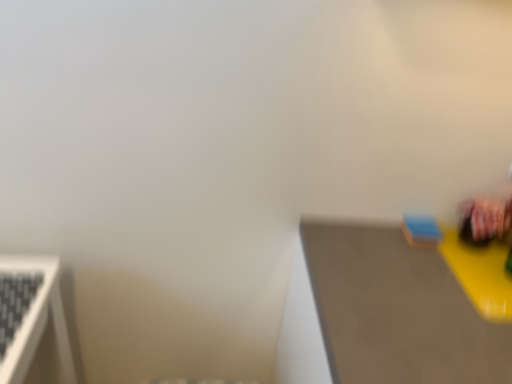
Question: Relative to smooth gray table at right, is matte plastic toy at right, which appears as the 2th toy when viewed from the left, in front or behind?

Choices:
 (A) front
 (B) behind

Answer: (B)

Question: Based on their sizes in the image, would you say matte plastic toy at right, which is counted as the 1th toy, starting from the right, is bigger or smaller than smooth gray table at right?

Choices:
 (A) big
 (B) small

Answer: (B)

Question: Which is farther from the blue matte sponge at upper right, which is the first toy in left-to-right order?

Choices:
 (A) matte plastic toy at right, which appears as the 2th toy when viewed from the left
 (B) smooth gray table at right

Answer: (B)

Question: Which object is positioned closest to the blue matte sponge at upper right, placed as the 2th toy when sorted from right to left?

Choices:
 (A) smooth gray table at right
 (B) matte plastic toy at right, which is counted as the 1th toy, starting from the right

Answer: (B)